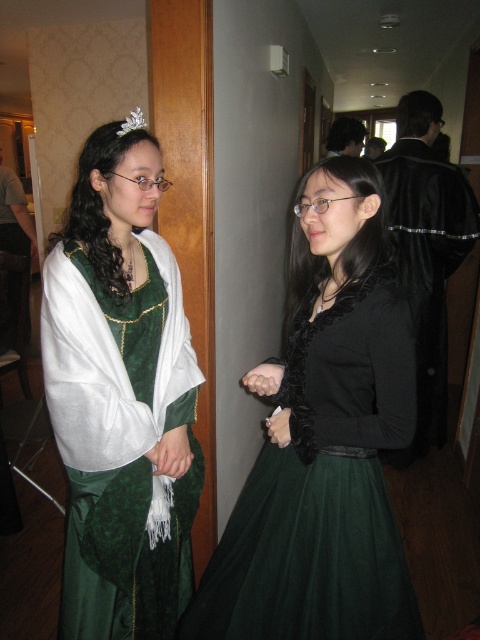
Question: Which object is the farthest from the matte black blouse at center?

Choices:
 (A) black leather robe at right
 (B) matte black glove at center

Answer: (A)

Question: Can you confirm if velvet green dress at center is bigger than black leather robe at right?

Choices:
 (A) yes
 (B) no

Answer: (B)

Question: Estimate the real-world distances between objects in this image. Which object is closer to the black leather robe at right?

Choices:
 (A) velvet green dress at center
 (B) white fabric at center
 (C) silver metallic tiara at upper left
 (D) matte black glove at center

Answer: (A)

Question: Does matte black blouse at center have a greater width compared to smooth skin hand at center?

Choices:
 (A) yes
 (B) no

Answer: (A)

Question: Is velvet green dress at center to the right of silver metallic tiara at upper left from the viewer's perspective?

Choices:
 (A) no
 (B) yes

Answer: (A)

Question: Among these points, which one is farthest from the camera?

Choices:
 (A) (127, 125)
 (B) (170, 436)
 (C) (314, 568)

Answer: (B)